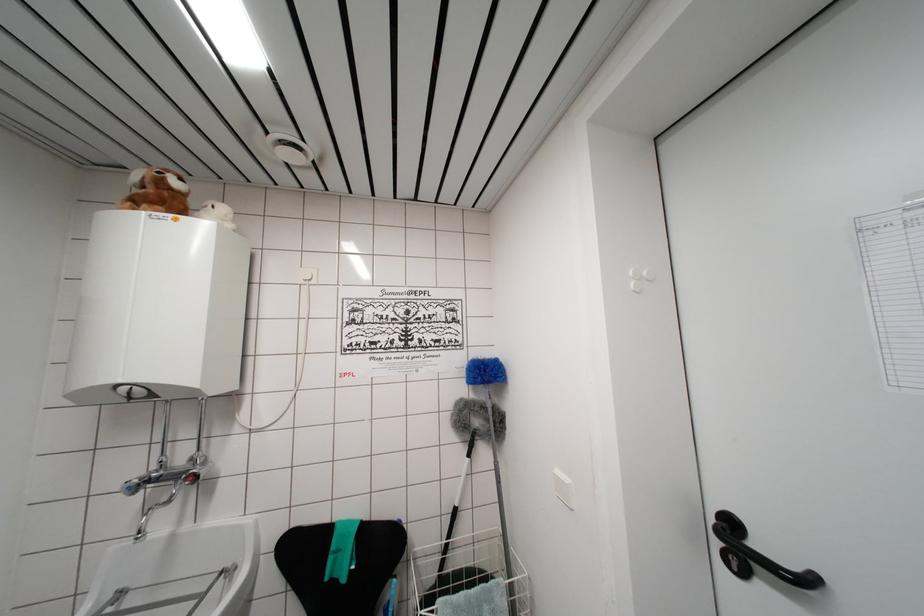
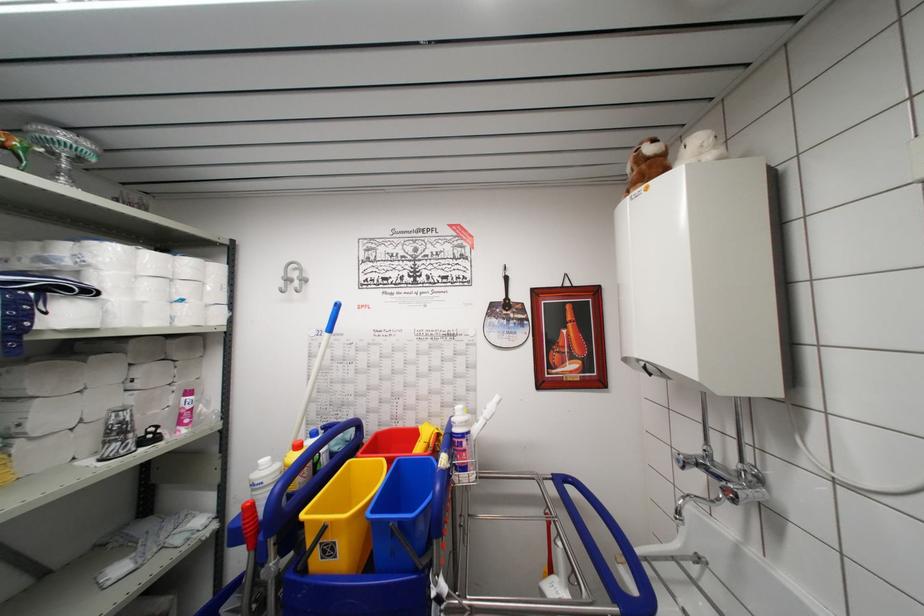
Question: How did the camera likely rotate?

Choices:
 (A) Left
 (B) Right
 (C) Up
 (D) Down

Answer: (A)